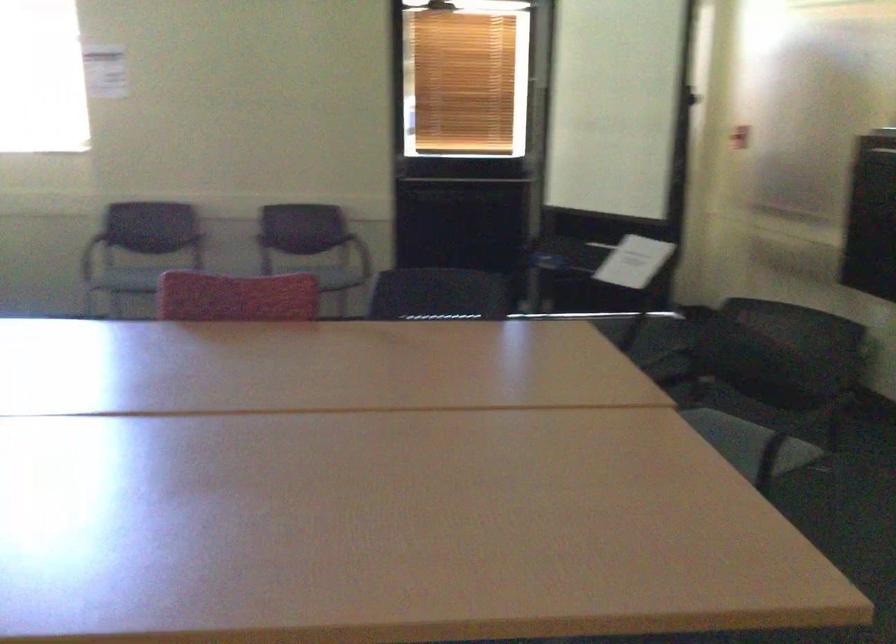
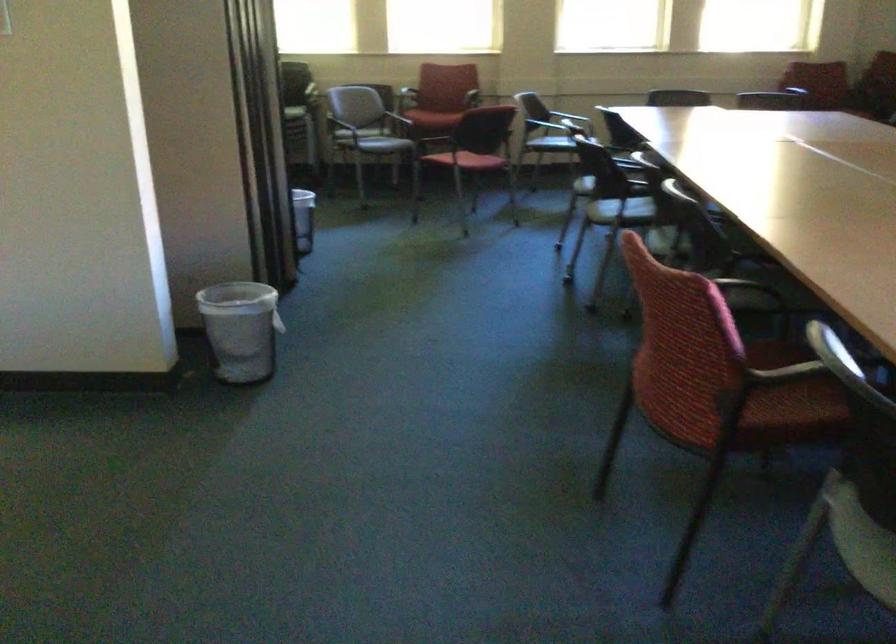
First-person continuous shooting, in which direction is the camera rotating?

The camera's rotation is toward left-down.